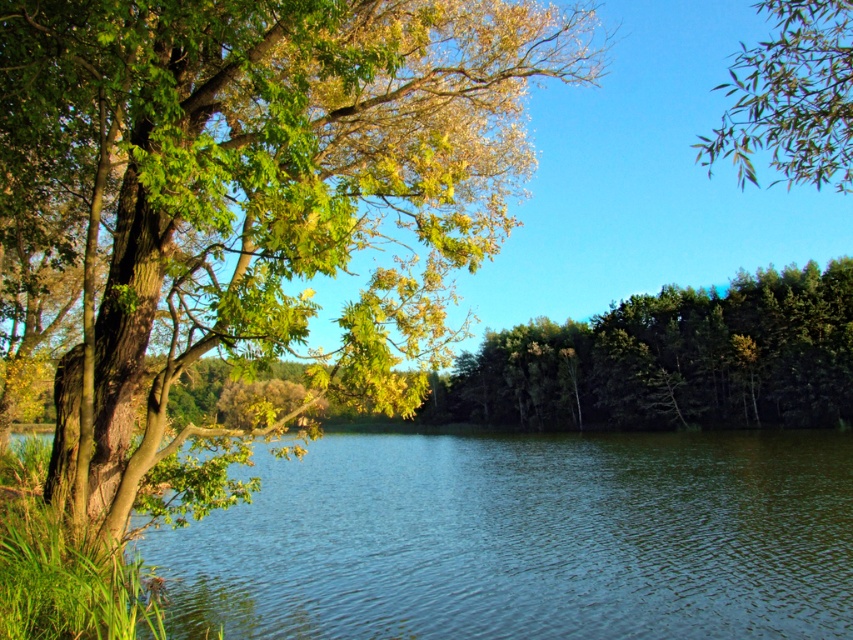
Can you confirm if clear blue water at center is thinner than green leafy branch at upper right?

Incorrect, clear blue water at center's width is not less than green leafy branch at upper right's.

Find the location of a particular element. This screenshot has height=640, width=853. clear blue water at center is located at coordinates (525, 540).

Identify the location of clear blue water at center. (525, 540).

Is green leafy tree at left wider than green leafy branch at upper right?

Incorrect, green leafy tree at left's width does not surpass green leafy branch at upper right's.

Can you confirm if green leafy tree at left is positioned below green leafy branch at upper right?

Yes, green leafy tree at left is below green leafy branch at upper right.

Does point (498, 156) come behind point (732, 124)?

Yes, point (498, 156) is behind point (732, 124).

At what (x,y) coordinates should I click in order to perform the action: click on green leafy tree at left. Please return your answer as a coordinate pair (x, y). This screenshot has width=853, height=640. Looking at the image, I should click on (252, 204).

Does green leafy tree at left appear on the right side of clear blue water at center?

Incorrect, green leafy tree at left is not on the right side of clear blue water at center.

Does green leafy tree at left have a lesser width compared to clear blue water at center?

Yes.

Does point (132, 141) come farther from viewer compared to point (753, 616)?

No, it is not.

Image resolution: width=853 pixels, height=640 pixels. Identify the location of green leafy tree at left. (252, 204).